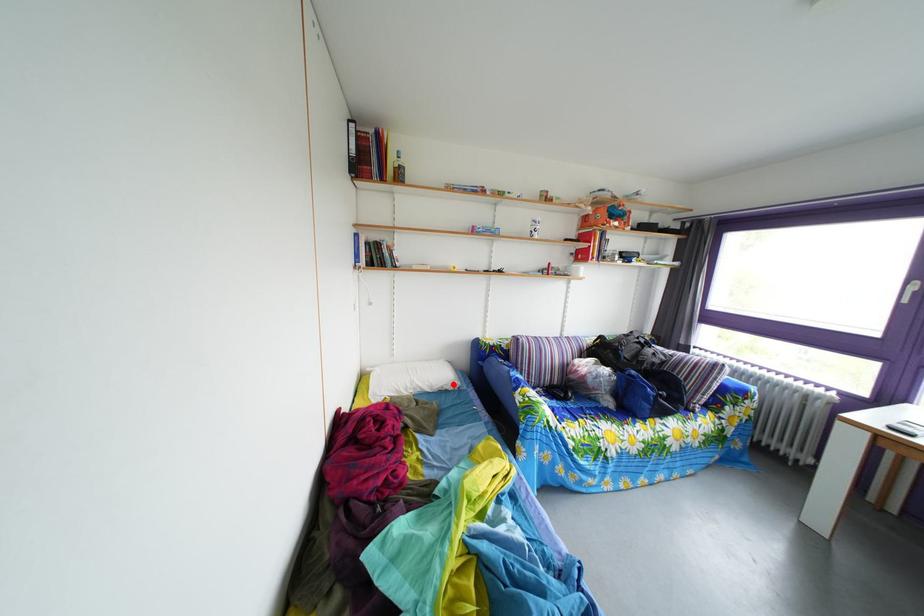
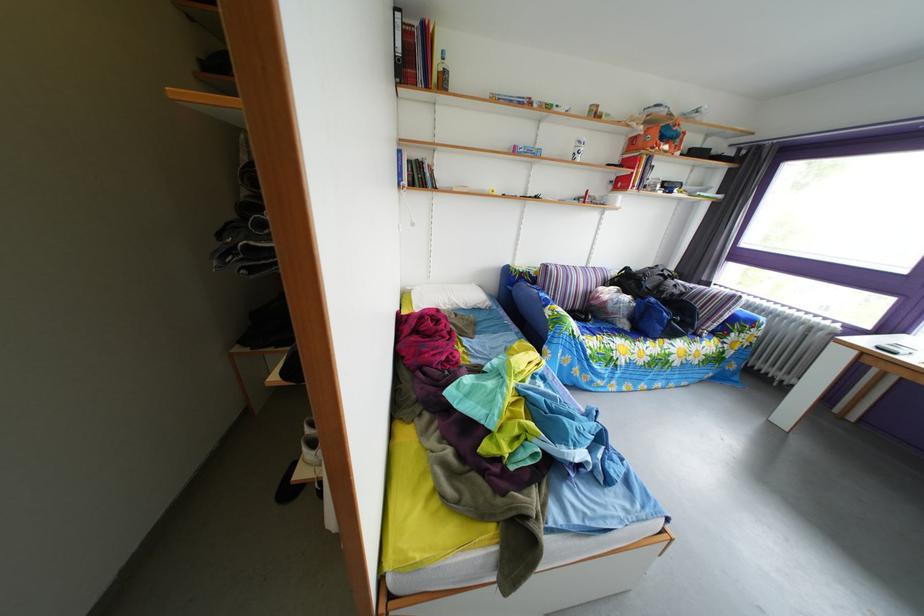
The point at the highlighted location is marked in the first image. Where is the corresponding point in the second image?

(485, 305)